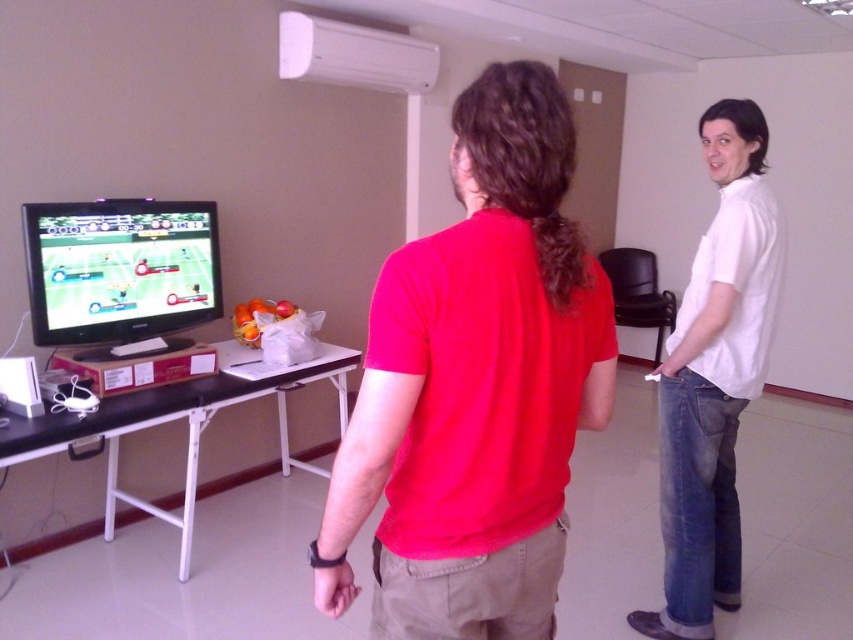
You are standing in the room and want to hand a fruit from the bowl on the table to the person wearing the red matte shirt at center. Can you directly hand it to them without needing to move around the white cotton shirt at right?

Yes, because the red matte shirt at center is in front of the white cotton shirt at right, so you can directly hand the fruit to them without moving around.

You are standing in the room and want to pick up an object. There are two points marked in the image. Which point is closer to you, point [474,163] or point [187,246]?

Point [474,163] is closer to the camera than point [187,246], so you should pick up the object at point [474,163] first since it is closer to you.